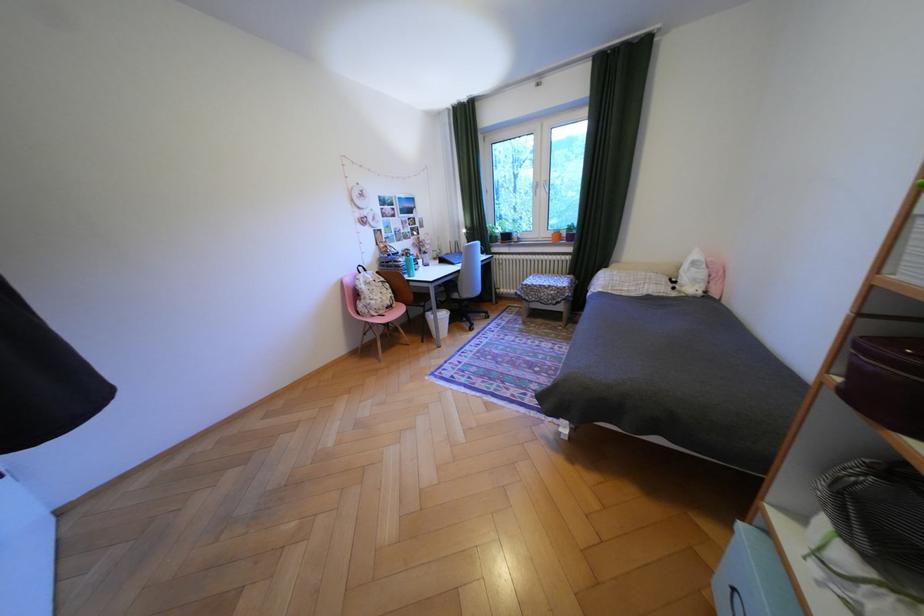
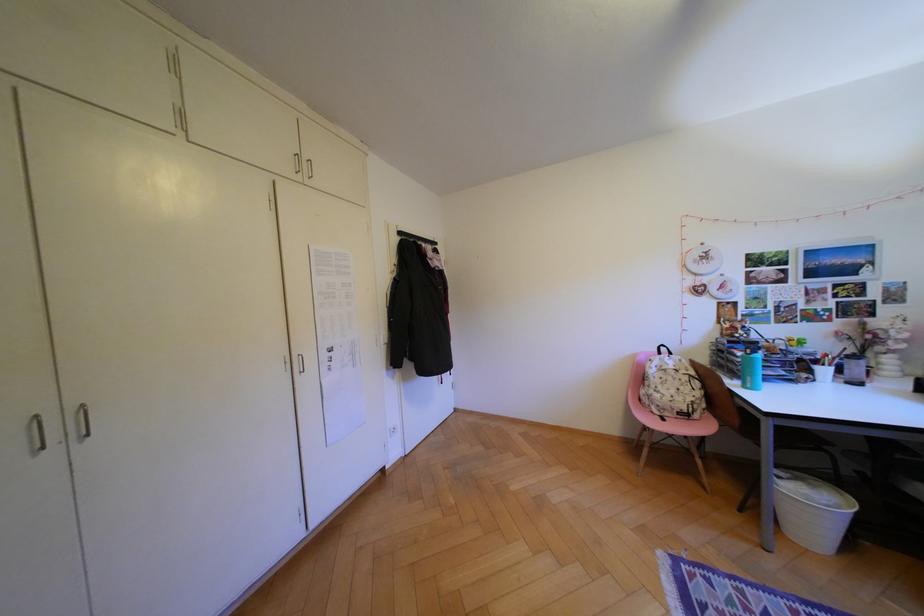
Question: Based on the continuous images, in which direction is the camera rotating? Reply with the corresponding letter.

Choices:
 (A) Left
 (B) Right
 (C) Up
 (D) Down

Answer: (A)